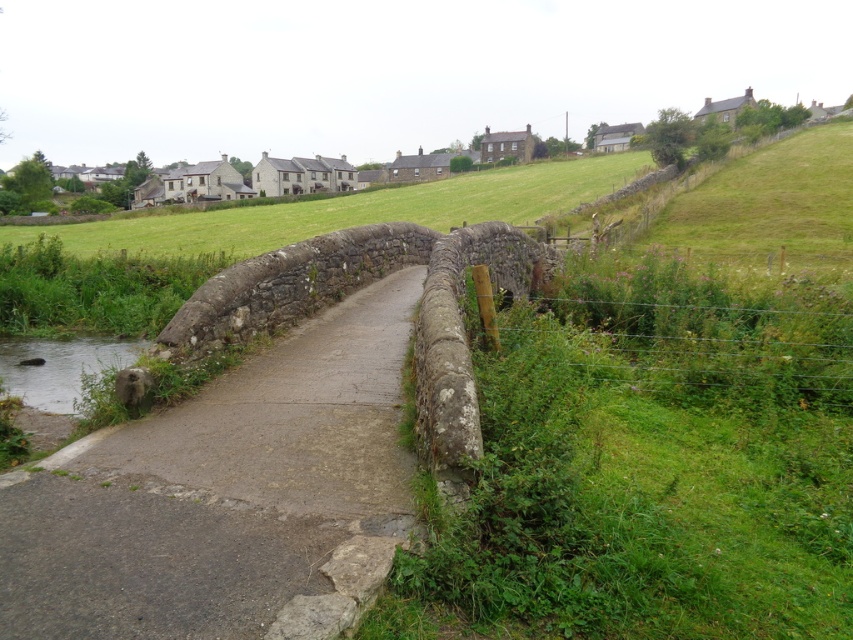
You are a hiker carrying a large backpack and need to cross the stone bridge. The gray concrete path at center and the wire mesh fence at right are in your way. Which of the two has a narrower width that might make it harder to navigate with your backpack?

The gray concrete path at center has a lesser width compared to the wire mesh fence at right, so it is narrower and might make it harder to navigate with your backpack.

You are a hiker who wants to cross the stream shown in the image. You see the gray concrete path at center and the clear water at lower left. Which one should you choose to safely cross the stream?

The gray concrete path at center is to the right of clear water at lower left, so you should choose the gray concrete path at center to safely cross the stream since it is a constructed path designed for crossing, while the clear water at lower left is part of the stream itself and may be unsafe.

You are standing at the stone bridge and want to walk to the point marked as point (93, 593). There is another point marked as point (624, 298) behind it. Which direction should you face to ensure you are moving towards the first point without passing the second point?

You should face the direction towards point (93, 593) since it is in front of point (624, 298), meaning you can reach it without passing the latter point.